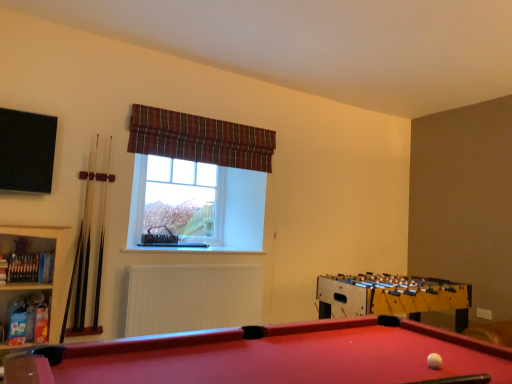
Question: From a real-world perspective, is white wood cue at left, the first cue when ordered from right to left, beneath clear glass window at center?

Choices:
 (A) yes
 (B) no

Answer: (A)

Question: From a real-world perspective, does white wood cue at left, the first cue when ordered from right to left, stand above clear glass window at center?

Choices:
 (A) no
 (B) yes

Answer: (A)

Question: Is white wood cue at left, the first cue when ordered from right to left, outside clear glass window at center?

Choices:
 (A) no
 (B) yes

Answer: (B)

Question: Is white wood cue at left, positioned as the second cue in left-to-right order, wider than clear glass window at center?

Choices:
 (A) yes
 (B) no

Answer: (B)

Question: Considering the relative sizes of white wood cue at left, the first cue when ordered from right to left, and clear glass window at center in the image provided, is white wood cue at left, the first cue when ordered from right to left, thinner than clear glass window at center?

Choices:
 (A) yes
 (B) no

Answer: (A)

Question: Is wooden bookshelf at left taller or shorter than rubberized felt pool table at lower left?

Choices:
 (A) short
 (B) tall

Answer: (B)

Question: Is point (20, 258) closer or farther from the camera than point (379, 365)?

Choices:
 (A) farther
 (B) closer

Answer: (A)

Question: Looking at the image, does wooden bookshelf at left seem bigger or smaller compared to rubberized felt pool table at lower left?

Choices:
 (A) small
 (B) big

Answer: (A)

Question: From the image's perspective, is wooden bookshelf at left above or below rubberized felt pool table at lower left?

Choices:
 (A) below
 (B) above

Answer: (B)

Question: Would you say light brown wooden cue at left, the second cue in the right-to-left sequence, is inside or outside yellow wooden foosball table at right?

Choices:
 (A) inside
 (B) outside

Answer: (B)

Question: Considering their positions, is light brown wooden cue at left, acting as the first cue starting from the left, located in front of or behind yellow wooden foosball table at right?

Choices:
 (A) behind
 (B) front

Answer: (A)

Question: In terms of width, does light brown wooden cue at left, the second cue in the right-to-left sequence, look wider or thinner when compared to yellow wooden foosball table at right?

Choices:
 (A) wide
 (B) thin

Answer: (B)

Question: Does point (75, 329) appear closer or farther from the camera than point (420, 296)?

Choices:
 (A) closer
 (B) farther

Answer: (A)

Question: In terms of height, does plaid fabric curtain at upper center look taller or shorter compared to light brown wooden cue at left, acting as the first cue starting from the left?

Choices:
 (A) tall
 (B) short

Answer: (B)

Question: Considering the positions of plaid fabric curtain at upper center and light brown wooden cue at left, the second cue in the right-to-left sequence, in the image, is plaid fabric curtain at upper center wider or thinner than light brown wooden cue at left, the second cue in the right-to-left sequence,?

Choices:
 (A) thin
 (B) wide

Answer: (B)